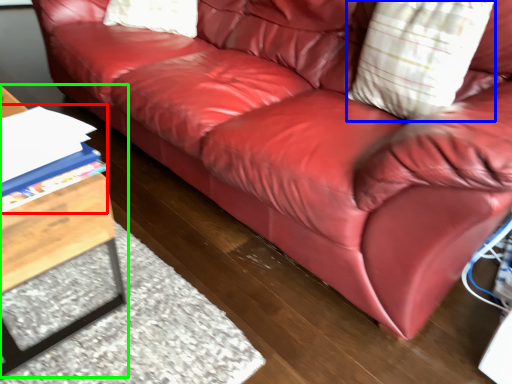
Question: Which object is the farthest from book (highlighted by a red box)? Choose among these: throw pillow (highlighted by a blue box) or table (highlighted by a green box).

Choices:
 (A) throw pillow
 (B) table

Answer: (A)